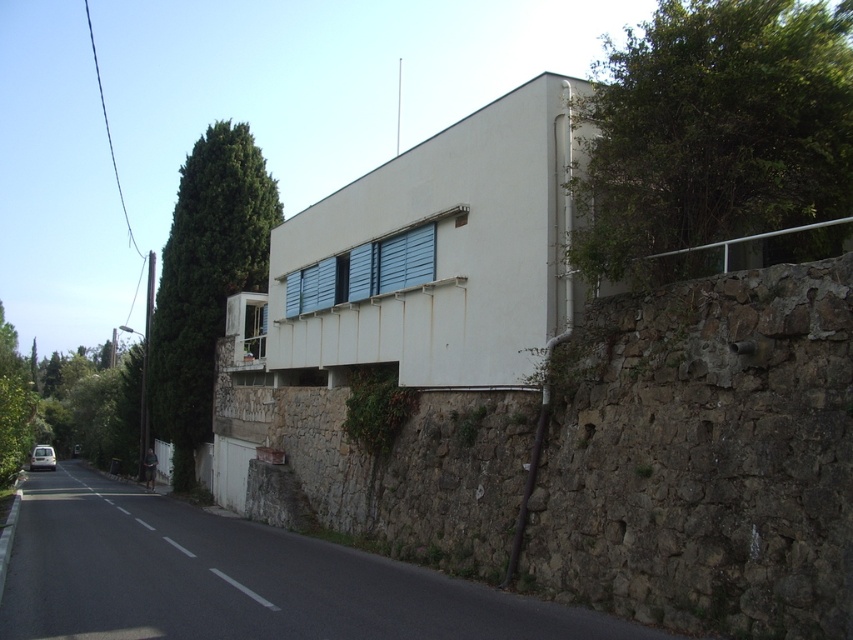
You are standing on the quiet road in front of the modern building. You see the white stone wall at center and the green leafy tree at left. Which object is closer to you?

The white stone wall at center is closer to you because it is in front of the green leafy tree at left.

You are standing on the quiet road in front of the modern building. There is a point marked at coordinates (x=704, y=458). Based on the scene, what does this point most likely represent?

The point at coordinates (x=704, y=458) most likely represents the white stone wall at center, as described in the scene.